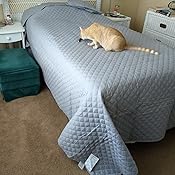
At what (x,y) coordinates should I click in order to perform the action: click on items on dresser. Please return your answer as a coordinate pair (x, y). This screenshot has width=175, height=175. Looking at the image, I should click on (165, 8), (172, 3).